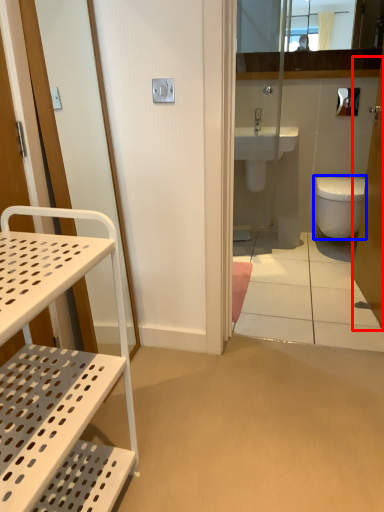
Question: Which object is further to the camera taking this photo, screen door (highlighted by a red box) or bidet (highlighted by a blue box)?

Choices:
 (A) screen door
 (B) bidet

Answer: (B)